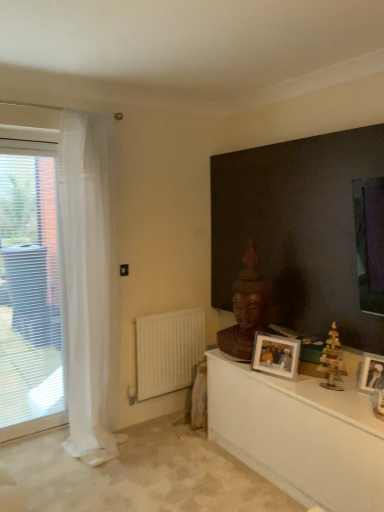
The width and height of the screenshot is (384, 512). Find the location of `blank space situated above transparent glass window at left (from a real-world perspective)`. blank space situated above transparent glass window at left (from a real-world perspective) is located at coordinates (26, 147).